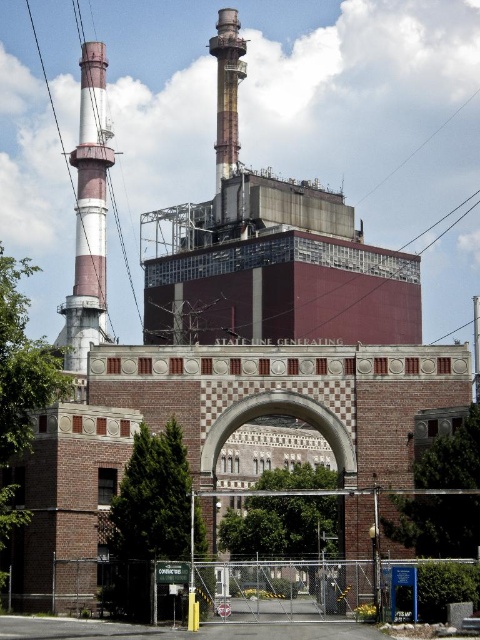
What do you see at coordinates (227, 90) in the screenshot? The image size is (480, 640). I see `shiny metallic tower at upper center` at bounding box center [227, 90].

Between point (216, 156) and point (259, 592), which one is positioned in front?

Positioned in front is point (259, 592).

Locate an element on the screen. The width and height of the screenshot is (480, 640). shiny metallic tower at upper center is located at coordinates (227, 90).

Which is in front, point (82, 140) or point (369, 609)?

Positioned in front is point (369, 609).

Is white-painted concrete chimney at left closer to the viewer compared to green leafy plant at center?

No, white-painted concrete chimney at left is further to the viewer.

Which is behind, point (81, 170) or point (355, 608)?

The point (81, 170) is behind.

Locate an element on the screen. white-painted concrete chimney at left is located at coordinates (88, 216).

Does shiny metallic tower at upper center have a lesser width compared to green leafy plant at center?

In fact, shiny metallic tower at upper center might be wider than green leafy plant at center.

Does shiny metallic tower at upper center come in front of green leafy plant at center?

No, shiny metallic tower at upper center is further to the viewer.

Image resolution: width=480 pixels, height=640 pixels. Identify the location of shiny metallic tower at upper center. click(227, 90).